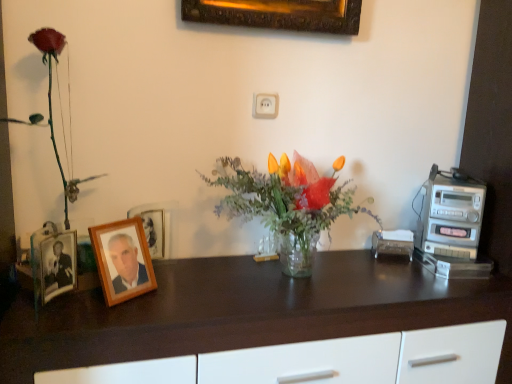
Question: Is the depth of dark wood desk at center greater than that of matte plastic rose at left?

Choices:
 (A) no
 (B) yes

Answer: (A)

Question: Considering the relative sizes of dark wood desk at center and matte plastic rose at left in the image provided, is dark wood desk at center taller than matte plastic rose at left?

Choices:
 (A) no
 (B) yes

Answer: (A)

Question: Does dark wood desk at center turn towards matte plastic rose at left?

Choices:
 (A) yes
 (B) no

Answer: (B)

Question: From a real-world perspective, does dark wood desk at center stand above matte plastic rose at left?

Choices:
 (A) yes
 (B) no

Answer: (B)

Question: Would you consider dark wood desk at center to be distant from matte plastic rose at left?

Choices:
 (A) yes
 (B) no

Answer: (B)

Question: Considering the relative sizes of dark wood desk at center and matte plastic rose at left in the image provided, is dark wood desk at center smaller than matte plastic rose at left?

Choices:
 (A) yes
 (B) no

Answer: (B)

Question: Is clear glass vase at center to the right of matte plastic rose at left from the viewer's perspective?

Choices:
 (A) no
 (B) yes

Answer: (B)

Question: Is clear glass vase at center facing towards matte plastic rose at left?

Choices:
 (A) no
 (B) yes

Answer: (A)

Question: Is there a large distance between clear glass vase at center and matte plastic rose at left?

Choices:
 (A) yes
 (B) no

Answer: (B)

Question: Is clear glass vase at center positioned before matte plastic rose at left?

Choices:
 (A) yes
 (B) no

Answer: (B)

Question: Is clear glass vase at center further to camera compared to matte plastic rose at left?

Choices:
 (A) no
 (B) yes

Answer: (B)

Question: From the image's perspective, is clear glass vase at center over matte plastic rose at left?

Choices:
 (A) yes
 (B) no

Answer: (B)

Question: From a real-world perspective, is dark wood desk at center on wooden picture frame at left, arranged as the first picture frame when viewed from the back?

Choices:
 (A) no
 (B) yes

Answer: (A)